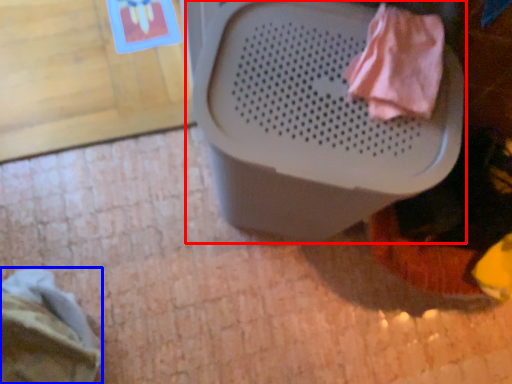
Question: Which object appears closest to the camera in this image, waste container (highlighted by a red box) or clothing (highlighted by a blue box)?

Choices:
 (A) waste container
 (B) clothing

Answer: (A)